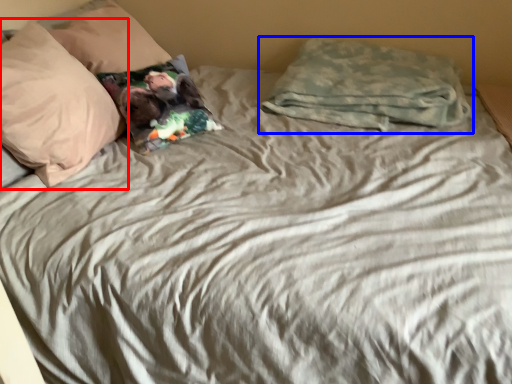
Question: Which point is further to the camera, pillow (highlighted by a red box) or pillow (highlighted by a blue box)?

Choices:
 (A) pillow
 (B) pillow

Answer: (B)